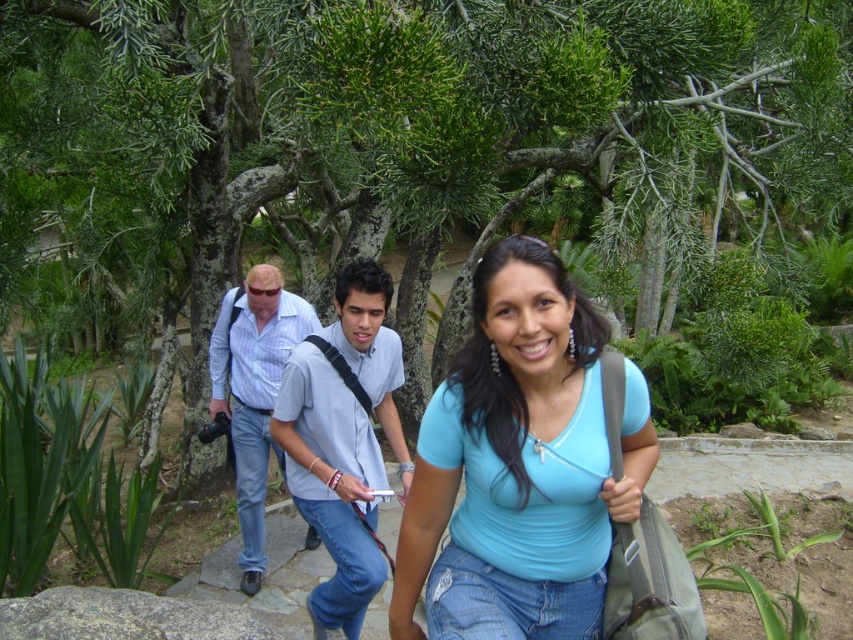
Question: Estimate the real-world distances between objects in this image. Which object is closer to the blue matte shirt at center?

Choices:
 (A) gray rough rock at lower left
 (B) blue plaid shirt at center
 (C) light blue shirt at center

Answer: (A)

Question: Does light blue shirt at center appear on the left side of blue plaid shirt at center?

Choices:
 (A) yes
 (B) no

Answer: (B)

Question: Does blue matte shirt at center have a larger size compared to light blue shirt at center?

Choices:
 (A) yes
 (B) no

Answer: (B)

Question: Is blue matte shirt at center positioned before gray rough rock at lower left?

Choices:
 (A) yes
 (B) no

Answer: (A)

Question: Based on their relative distances, which object is farther from the light blue shirt at center?

Choices:
 (A) blue plaid shirt at center
 (B) gray rough rock at lower left
 (C) blue matte shirt at center

Answer: (C)

Question: Based on their relative distances, which object is nearer to the gray rough rock at lower left?

Choices:
 (A) blue matte shirt at center
 (B) light blue shirt at center
 (C) blue plaid shirt at center

Answer: (B)